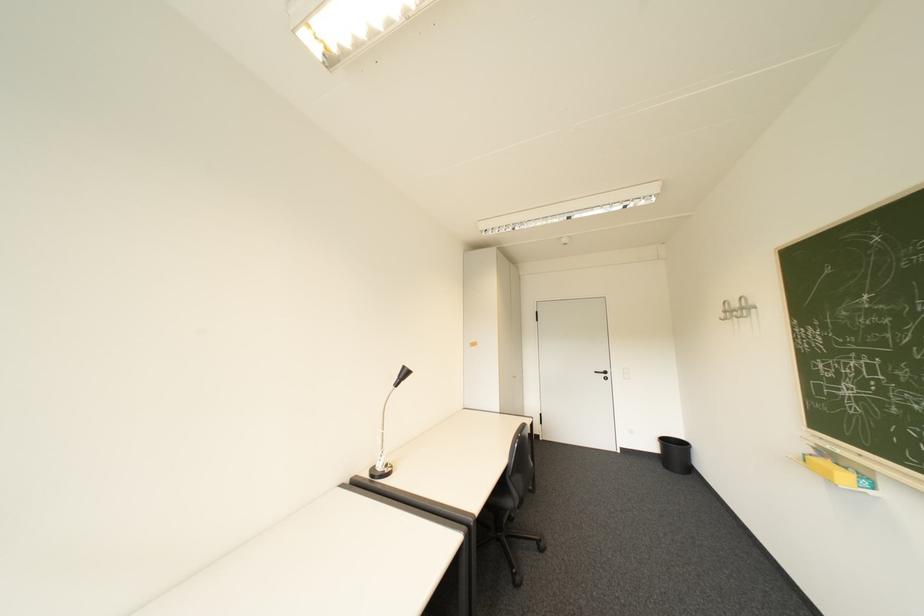
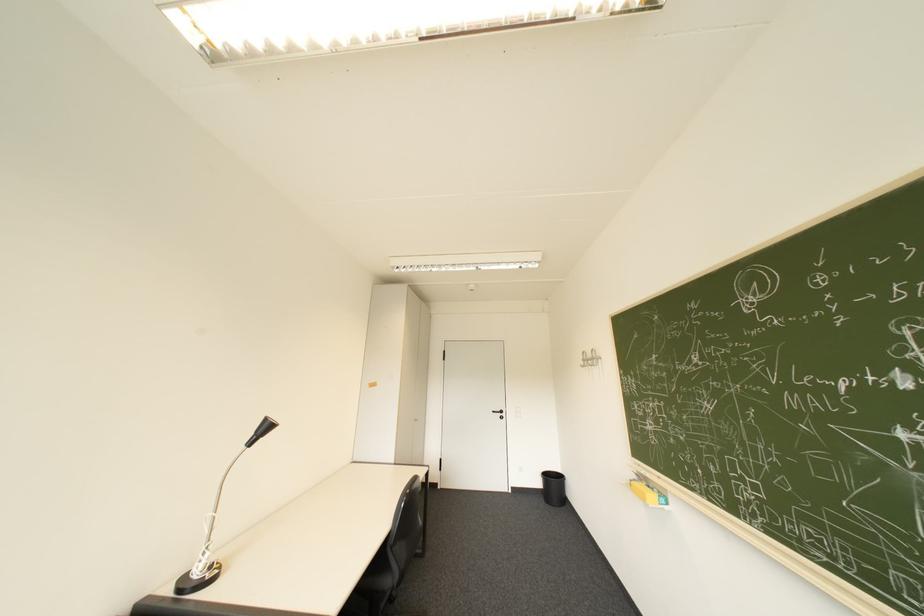
Locate, in the second image, the point that corresponds to (626,376) in the first image.

(519, 415)